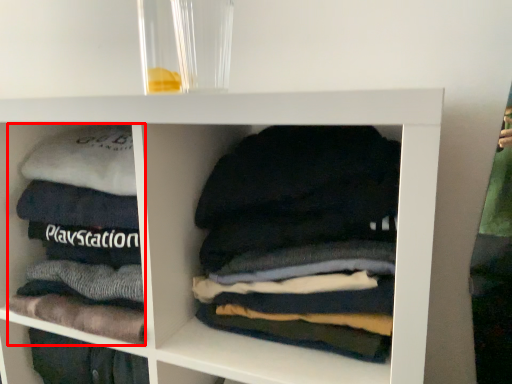
Question: In this image, where is material (annotated by the red box) located relative to laundry?

Choices:
 (A) right
 (B) left

Answer: (B)